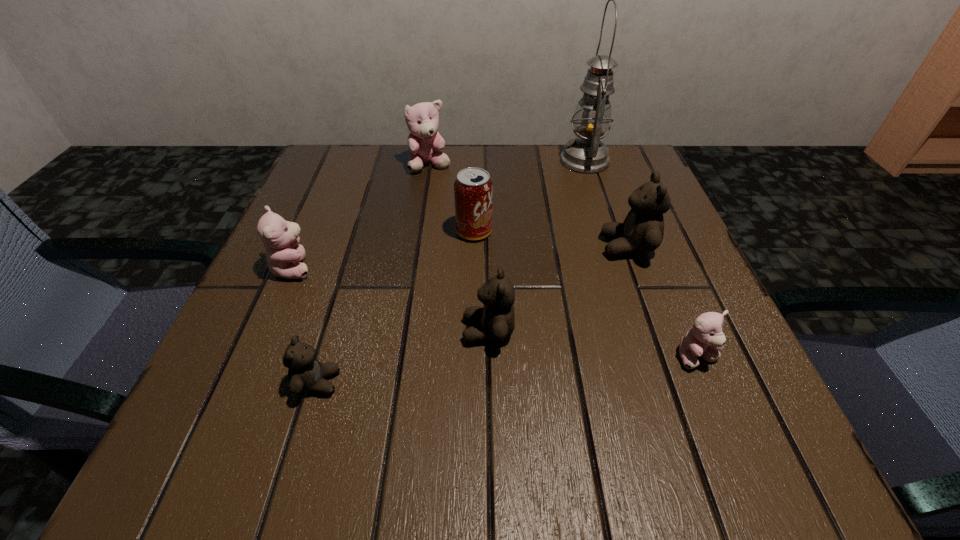
Locate an element on the screen. The width and height of the screenshot is (960, 540). free space between the rightmost brown teddy bear and the oil lamp is located at coordinates (606, 204).

This screenshot has height=540, width=960. I want to click on unoccupied position between the farthest brown teddy bear and the nearest pink teddy bear, so click(x=662, y=302).

Where is `free space between the third teddy bear from left to right and the biggest brown teddy bear`? The height and width of the screenshot is (540, 960). free space between the third teddy bear from left to right and the biggest brown teddy bear is located at coordinates (529, 206).

At what (x,y) coordinates should I click in order to perform the action: click on unoccupied position between the smallest pink teddy bear and the farthest brown teddy bear. Please return your answer as a coordinate pair (x, y). This screenshot has height=540, width=960. Looking at the image, I should click on (662, 302).

Locate an element on the screen. unoccupied position between the rightmost brown teddy bear and the second smallest brown teddy bear is located at coordinates (558, 289).

Where is `vacant space that is in between the soda can and the nearest pink teddy bear`? This screenshot has height=540, width=960. vacant space that is in between the soda can and the nearest pink teddy bear is located at coordinates (586, 294).

This screenshot has width=960, height=540. I want to click on vacant space that's between the nearest brown teddy bear and the soda can, so coord(396,307).

Identify which object is located as the second nearest to the nearest pink teddy bear. Please provide its 2D coordinates. Your answer should be formatted as a tuple, i.e. [(x, y)], where the tuple contains the x and y coordinates of a point satisfying the conditions above.

[(495, 321)]

Select which object appears as the sixth closest to the leftmost teddy bear. Please provide its 2D coordinates. Your answer should be formatted as a tuple, i.e. [(x, y)], where the tuple contains the x and y coordinates of a point satisfying the conditions above.

[(586, 154)]

This screenshot has width=960, height=540. What are the coordinates of `the third closest teddy bear relative to the second object from left to right` in the screenshot? It's located at tap(642, 231).